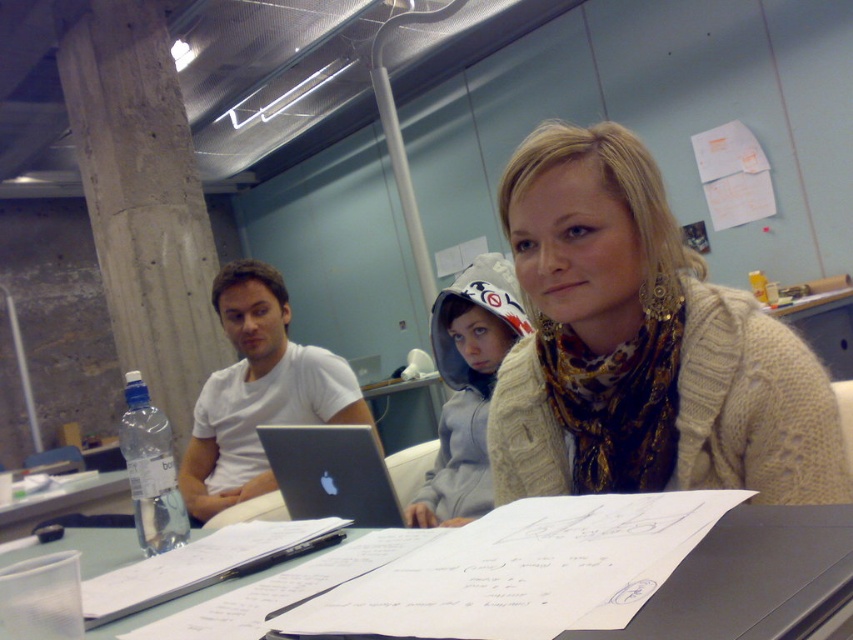
From the picture: Is concrete at left thinner than white matte shirt at center?

In fact, concrete at left might be wider than white matte shirt at center.

Does point (126, 157) come closer to viewer compared to point (357, 406)?

No.

At what (x,y) coordinates should I click in order to perform the action: click on concrete at left. Please return your answer as a coordinate pair (x, y). The height and width of the screenshot is (640, 853). Looking at the image, I should click on (142, 198).

Who is shorter, knitted beige sweater at center or white paper at center?

Standing shorter between the two is white paper at center.

Does knitted beige sweater at center have a smaller size compared to white paper at center?

Actually, knitted beige sweater at center might be larger than white paper at center.

Which is behind, point (613, 333) or point (780, 529)?

The point (613, 333) is more distant.

Identify the location of knitted beige sweater at center. (642, 346).

Which is behind, point (82, 74) or point (131, 531)?

The point (82, 74) is more distant.

At what (x,y) coordinates should I click in order to perform the action: click on concrete at left. Please return your answer as a coordinate pair (x, y). This screenshot has width=853, height=640. Looking at the image, I should click on (142, 198).